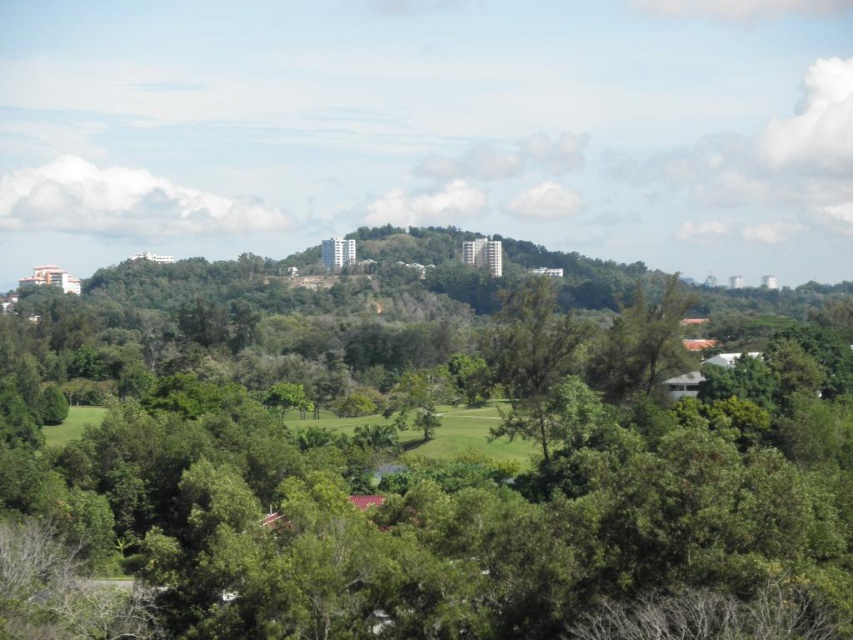
Question: Can you confirm if green leafy tree at center is bigger than green grassy field at center?

Choices:
 (A) no
 (B) yes

Answer: (B)

Question: Does green leafy tree at center have a lesser width compared to green grassy field at center?

Choices:
 (A) no
 (B) yes

Answer: (A)

Question: Is green leafy tree at center bigger than green grassy field at center?

Choices:
 (A) yes
 (B) no

Answer: (A)

Question: Which point appears farthest from the camera in this image?

Choices:
 (A) (433, 452)
 (B) (793, 561)

Answer: (A)

Question: Which point appears closest to the camera in this image?

Choices:
 (A) (297, 333)
 (B) (485, 436)

Answer: (B)